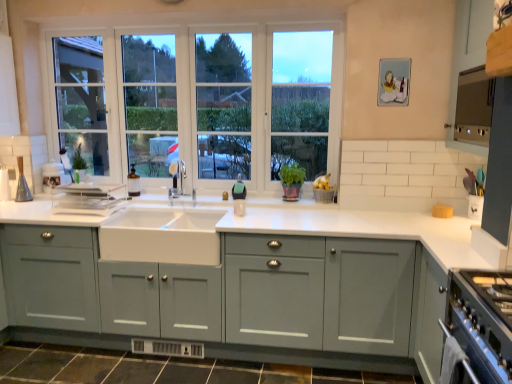
Question: Does point (116, 223) appear closer or farther from the camera than point (73, 56)?

Choices:
 (A) farther
 (B) closer

Answer: (B)

Question: From the image's perspective, is white ceramic sink at center positioned above or below clear glass window at center?

Choices:
 (A) above
 (B) below

Answer: (B)

Question: Which object is positioned closest to the white ceramic sink at center?

Choices:
 (A) satin stainless steel range hood at upper right
 (B) matte glass bottle at center
 (C) satin nickel faucet at center
 (D) clear glass window at center
 (E) matte gray cabinets at center, the first cabinetry from the bottom

Answer: (E)

Question: Estimate the real-world distances between objects in this image. Which object is closer to the matte gray cabinet at upper right, the second cabinetry when ordered from left to right?

Choices:
 (A) matte glass bottle at center
 (B) clear glass window at center
 (C) satin nickel faucet at center
 (D) white ceramic sink at center
 (E) matte gray cabinets at center, the 2th cabinetry from the right

Answer: (B)